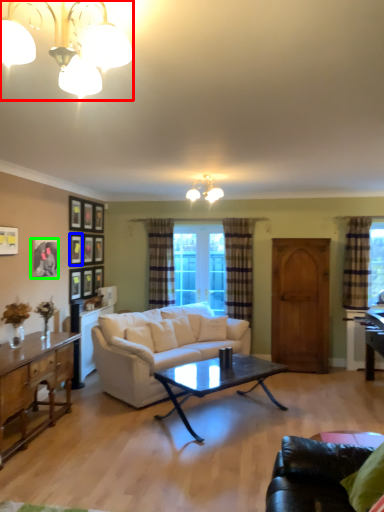
Question: Considering the real-world distances, which object is farthest from lamp (highlighted by a red box)? picture frame (highlighted by a blue box) or picture frame (highlighted by a green box)?

Choices:
 (A) picture frame
 (B) picture frame

Answer: (A)